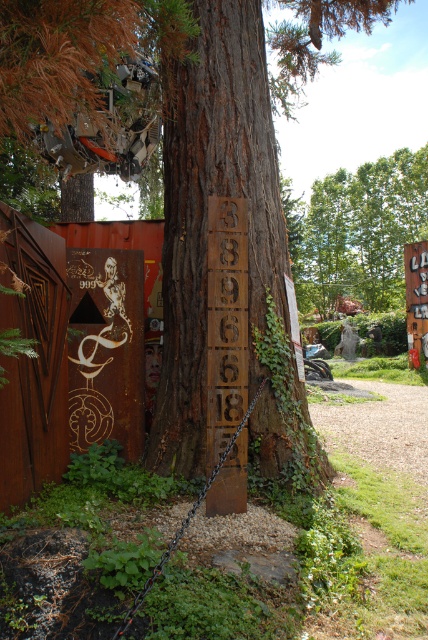
Does brown rough tree trunk at center come behind wooden sign at right?

No, brown rough tree trunk at center is in front of wooden sign at right.

Is point (205, 438) closer to camera compared to point (409, 358)?

Yes.

Is point (223, 364) farther from camera compared to point (416, 262)?

No, (223, 364) is in front of (416, 262).

Find the location of a particular element. brown rough tree trunk at center is located at coordinates (207, 212).

Is green leafy tree at upper center shorter than rusty metal sign at center?

No.

Between point (374, 291) and point (208, 499), which one is positioned behind?

The point (374, 291) is behind.

This screenshot has height=640, width=428. Identify the location of green leafy tree at upper center. pos(356,230).

Does brown rough tree trunk at center have a lesser height compared to green leafy tree at upper center?

Indeed, brown rough tree trunk at center has a lesser height compared to green leafy tree at upper center.

Measure the distance between point (249, 426) and camera.

The distance of point (249, 426) from camera is 11.73 feet.

Does point (226, 17) come farther from viewer compared to point (330, 209)?

No, (226, 17) is closer to viewer.

Locate an element on the screen. Image resolution: width=428 pixels, height=640 pixels. brown rough tree trunk at center is located at coordinates tap(207, 212).